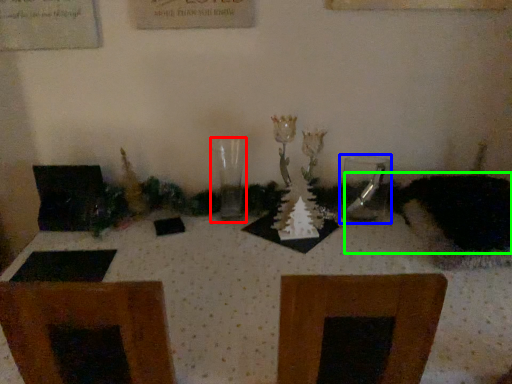
Question: Which is farther away from candle holder (highlighted by a red box)? tableware (highlighted by a blue box) or animal (highlighted by a green box)?

Choices:
 (A) tableware
 (B) animal

Answer: (B)